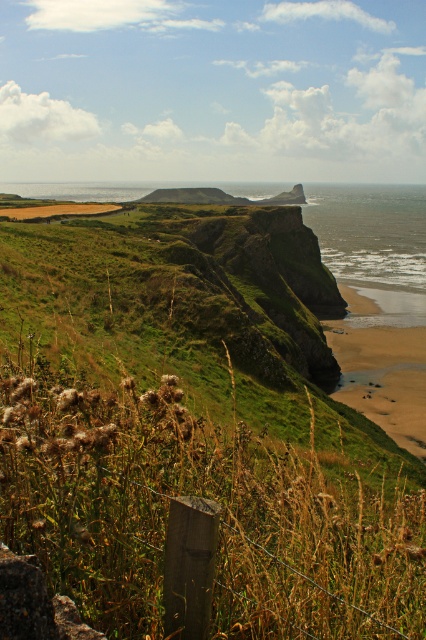
Question: Where is green grassy at center located in relation to sandy beach at lower right in the image?

Choices:
 (A) above
 (B) below

Answer: (A)

Question: Is green grassy at center closer to camera compared to sandy beach at lower right?

Choices:
 (A) no
 (B) yes

Answer: (B)

Question: Does green grassy at center come in front of sandy beach at lower right?

Choices:
 (A) yes
 (B) no

Answer: (A)

Question: Among these objects, which one is nearest to the camera?

Choices:
 (A) green grassy at center
 (B) sandy beach at lower right

Answer: (A)

Question: Which object is closer to the camera taking this photo?

Choices:
 (A) green grassy at center
 (B) sandy beach at lower right

Answer: (A)